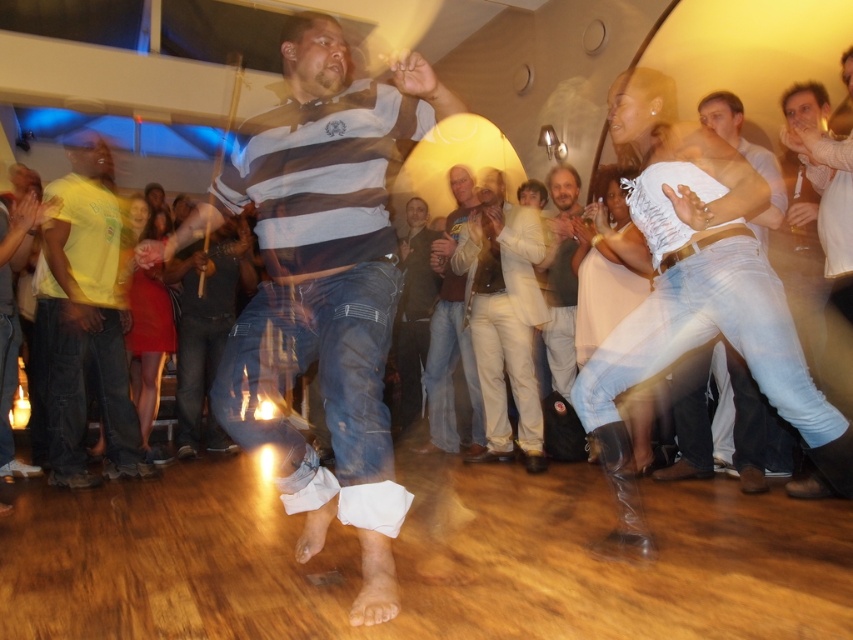
Question: Can you confirm if light blue jeans at right is smaller than dark brown leather jacket at center?

Choices:
 (A) yes
 (B) no

Answer: (A)

Question: Which point is farther to the camera?

Choices:
 (A) (599, 433)
 (B) (737, 465)
 (C) (436, 384)

Answer: (C)

Question: From the image, what is the correct spatial relationship of striped cotton shirt at center in relation to light blue jeans at right?

Choices:
 (A) left
 (B) right

Answer: (A)

Question: Estimate the real-world distances between objects in this image. Which object is farther from the light brown leather jacket at center?

Choices:
 (A) light beige cotton shirt at center
 (B) striped cotton shirt at center
 (C) light blue jeans at center
 (D) light blue jeans at right

Answer: (B)

Question: Which object is closer to the camera taking this photo?

Choices:
 (A) light blue jeans at center
 (B) light brown leather jacket at center
 (C) striped cotton shirt at center

Answer: (C)

Question: Does striped cotton shirt at center have a smaller size compared to light blue jeans at right?

Choices:
 (A) yes
 (B) no

Answer: (B)